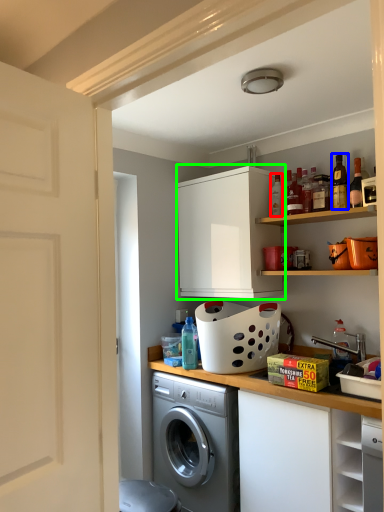
Question: Which object is the farthest from bottle (highlighted by a red box)? Choose among these: bottle (highlighted by a blue box) or cabinetry (highlighted by a green box).

Choices:
 (A) bottle
 (B) cabinetry

Answer: (B)